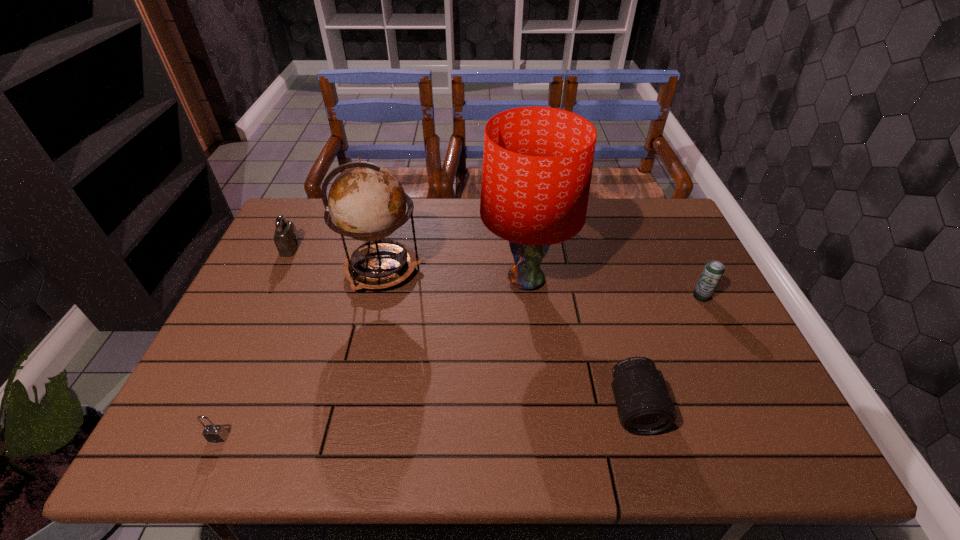
Where is `vacant space at the near edge of the desktop`? The image size is (960, 540). vacant space at the near edge of the desktop is located at coordinates (650, 448).

Locate an element on the screen. This screenshot has height=540, width=960. blank space at the left edge of the desktop is located at coordinates (295, 294).

The height and width of the screenshot is (540, 960). What are the coordinates of `vacant space at the right edge of the desktop` in the screenshot? It's located at (674, 256).

The width and height of the screenshot is (960, 540). In the image, there is a desktop. Identify the location of free region at the far right corner. tap(640, 226).

The height and width of the screenshot is (540, 960). Identify the location of free location at the near right corner. (767, 434).

Where is `empty space that is in between the beer can and the shortest object`? The width and height of the screenshot is (960, 540). empty space that is in between the beer can and the shortest object is located at coordinates (460, 367).

Identify the location of free space between the nearer padlock and the beer can. The image size is (960, 540). (460, 367).

Image resolution: width=960 pixels, height=540 pixels. What are the coordinates of `free space between the taller padlock and the rightmost object` in the screenshot? It's located at (495, 272).

Identify the location of free space between the taller padlock and the third object from left to right. (336, 259).

Where is `vacant area between the telephoto lens and the tallest object`? vacant area between the telephoto lens and the tallest object is located at coordinates (580, 343).